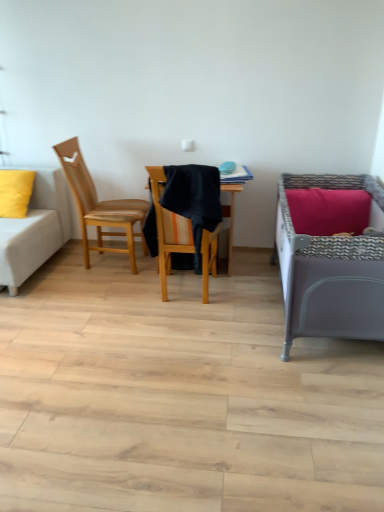
The height and width of the screenshot is (512, 384). I want to click on vacant area in front of wooden chair at left, the second chair from the right, so click(95, 288).